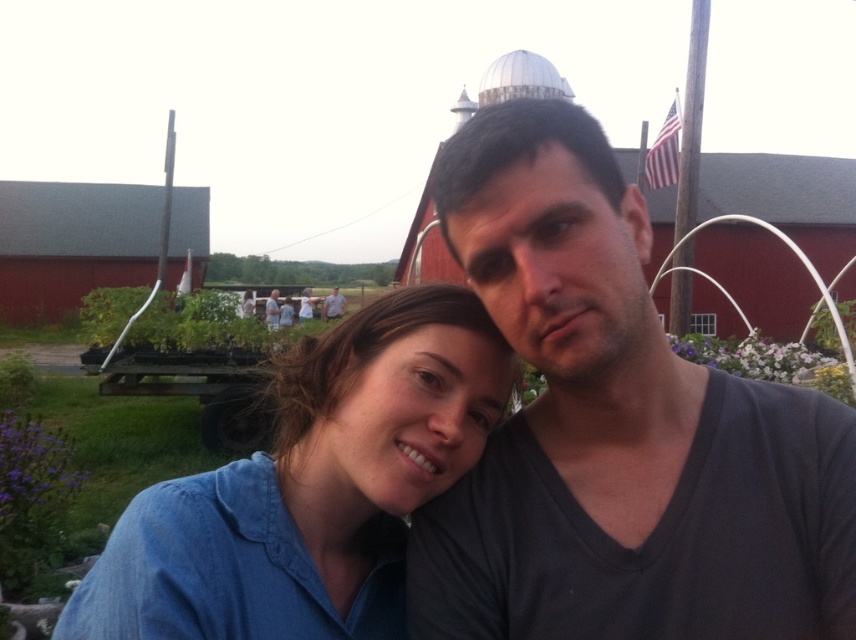
Where is `matte gray shirt at center`? The width and height of the screenshot is (856, 640). matte gray shirt at center is located at coordinates (333, 305).

Who is more distant from viewer, (324, 317) or (272, 298)?

The point (324, 317) is behind.

Does point (328, 308) come behind point (276, 320)?

Yes, point (328, 308) is behind point (276, 320).

Find the location of a particular element. matte gray shirt at center is located at coordinates (333, 305).

Is point (710, 538) closer to viewer compared to point (287, 488)?

Yes, point (710, 538) is in front of point (287, 488).

From the picture: Is the position of dark gray v-neck shirt at center more distant than that of blue denim shirt at center?

No, it is not.

Is point (718, 556) less distant than point (456, 428)?

Yes, point (718, 556) is closer to viewer.

The image size is (856, 640). I want to click on dark gray v-neck shirt at center, so click(x=617, y=429).

Does blue denim shirt at center have a lesser width compared to matte gray shirt at center?

In fact, blue denim shirt at center might be wider than matte gray shirt at center.

Is blue denim shirt at center to the left of matte gray shirt at center from the viewer's perspective?

In fact, blue denim shirt at center is to the right of matte gray shirt at center.

Which is behind, point (489, 385) or point (331, 296)?

Point (331, 296)

Where is `blue denim shirt at center`? blue denim shirt at center is located at coordinates (312, 486).